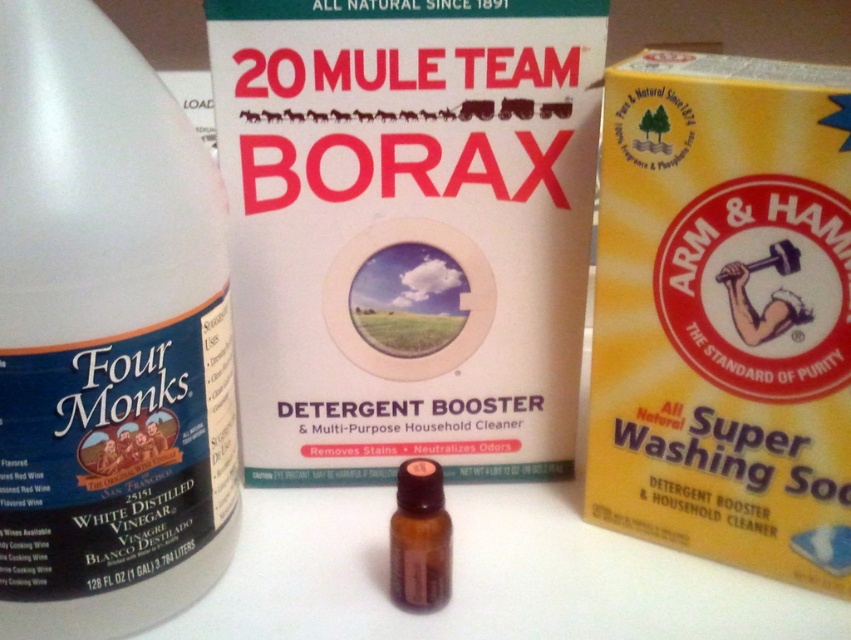
In order to click on white matte box at center in this screenshot , I will do `click(407, 228)`.

Locate an element on the screen. This screenshot has height=640, width=851. white matte box at center is located at coordinates (407, 228).

Image resolution: width=851 pixels, height=640 pixels. I want to click on white matte box at center, so click(407, 228).

Is white matte box at center bigger than yellow cardboard box at center?

Correct, white matte box at center is larger in size than yellow cardboard box at center.

The image size is (851, 640). Describe the element at coordinates (407, 228) in the screenshot. I see `white matte box at center` at that location.

Who is more forward, (355,340) or (787,164)?

Point (787,164) is more forward.

The height and width of the screenshot is (640, 851). What are the coordinates of `white matte box at center` in the screenshot? It's located at (407, 228).

Is yellow cardboard box at center bigger than brown glass bottle at center?

Yes.

Which is behind, point (661, 532) or point (421, 609)?

The point (661, 532) is behind.

Which is in front, point (760, 112) or point (404, 588)?

Point (760, 112) is in front.

The image size is (851, 640). What are the coordinates of `yellow cardboard box at center` in the screenshot? It's located at (724, 314).